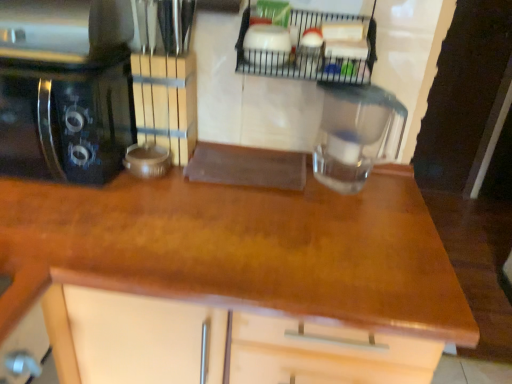
Identify the location of metallic wire rack at upper center. This screenshot has width=512, height=384. (304, 46).

The height and width of the screenshot is (384, 512). Identify the location of transparent glass jar at center. (356, 134).

What do you see at coordinates (356, 134) in the screenshot? The width and height of the screenshot is (512, 384). I see `transparent glass jar at center` at bounding box center [356, 134].

Identify the location of wooden at center. The width and height of the screenshot is (512, 384). (242, 250).

The width and height of the screenshot is (512, 384). I want to click on metallic wire rack at upper center, so click(304, 46).

Locate an element on the screen. The width and height of the screenshot is (512, 384). shelf that appears above the black glossy coffee maker at left (from a real-world perspective) is located at coordinates (304, 46).

Can you confirm if black glossy coffee maker at left is bigger than metallic wire rack at upper center?

Yes, black glossy coffee maker at left is bigger than metallic wire rack at upper center.

From a real-world perspective, is black glossy coffee maker at left positioned above or below metallic wire rack at upper center?

black glossy coffee maker at left is situated lower than metallic wire rack at upper center in the real world.

Is black glossy coffee maker at left next to metallic wire rack at upper center and touching it?

They are not placed beside each other.

How different are the orientations of metallic wire rack at upper center and black glossy coffee maker at left in degrees?

They differ by 1.03 degrees in their facing directions.

Can you confirm if metallic wire rack at upper center is thinner than black glossy coffee maker at left?

Yes.

From the image's perspective, is metallic wire rack at upper center positioned above or below black glossy coffee maker at left?

Based on their image positions, metallic wire rack at upper center is located above black glossy coffee maker at left.

Between metallic wire rack at upper center and black glossy coffee maker at left, which one appears on the left side from the viewer's perspective?

black glossy coffee maker at left.

Where is `shelf above the wooden at center (from a real-world perspective)`? shelf above the wooden at center (from a real-world perspective) is located at coordinates (304, 46).

Would you consider metallic wire rack at upper center to be distant from wooden at center?

No, there isn't a large distance between metallic wire rack at upper center and wooden at center.

Considering the positions of point (243, 15) and point (3, 265), is point (243, 15) closer or farther from the camera than point (3, 265)?

Point (243, 15).

Considering the relative positions of metallic wire rack at upper center and wooden at center in the image provided, is metallic wire rack at upper center to the left of wooden at center from the viewer's perspective?

In fact, metallic wire rack at upper center is to the right of wooden at center.

Which is closer to the camera, [340,223] or [401,139]?

Point [340,223].

Which object is further away from the camera taking this photo, wooden at center or transparent glass jar at center?

transparent glass jar at center is behind.

Which object is wider, wooden at center or transparent glass jar at center?

wooden at center.

Based on the photo, would you say wooden at center is a long distance from black glossy coffee maker at left?

That's not correct — wooden at center is a little close to black glossy coffee maker at left.

Is wooden at center in front of or behind black glossy coffee maker at left in the image?

Clearly, wooden at center is in front of black glossy coffee maker at left.

Does wooden at center have a smaller size compared to black glossy coffee maker at left?

No, wooden at center is not smaller than black glossy coffee maker at left.

Considering the positions of objects black glossy coffee maker at left and transparent glass jar at center in the image provided, who is more to the left, black glossy coffee maker at left or transparent glass jar at center?

Positioned to the left is black glossy coffee maker at left.

Is point (57, 3) closer or farther from the camera than point (370, 139)?

Point (57, 3) appears to be closer to the viewer than point (370, 139).

From a real-world perspective, between black glossy coffee maker at left and transparent glass jar at center, who is vertically lower?

black glossy coffee maker at left.

Find the location of a particular element. Image resolution: width=512 pixels, height=384 pixels. home appliance that appears in front of the transparent glass jar at center is located at coordinates (62, 105).

Is transparent glass jar at center far away from wooden at center?

Actually, transparent glass jar at center and wooden at center are a little close together.

Can you tell me how much transparent glass jar at center and wooden at center differ in facing direction?

1.19 degrees.

From a real-world perspective, relative to wooden at center, is transparent glass jar at center vertically above or below?

Clearly, from a real-world perspective, transparent glass jar at center is above wooden at center.

Based on the photo, visually, is transparent glass jar at center positioned to the left or to the right of wooden at center?

Based on their positions, transparent glass jar at center is located to the right of wooden at center.

The height and width of the screenshot is (384, 512). Identify the location of home appliance located below the metallic wire rack at upper center (from the image's perspective). (62, 105).

I want to click on home appliance beneath the metallic wire rack at upper center (from a real-world perspective), so click(x=62, y=105).

Which object lies further to the anchor point black glossy coffee maker at left, transparent glass jar at center or wooden at center?

transparent glass jar at center.

From the picture: Based on their spatial positions, is black glossy coffee maker at left or wooden at center further from transparent glass jar at center?

black glossy coffee maker at left lies further to transparent glass jar at center than the other object.

Consider the image. Considering their positions, is transparent glass jar at center positioned further to black glossy coffee maker at left than metallic wire rack at upper center?

transparent glass jar at center.

Considering their positions, is black glossy coffee maker at left positioned closer to wooden at center than transparent glass jar at center?

transparent glass jar at center.

Looking at the image, which one is located further to wooden at center, transparent glass jar at center or metallic wire rack at upper center?

metallic wire rack at upper center lies further to wooden at center than the other object.

Looking at this image, estimate the real-world distances between objects in this image. Which object is closer to metallic wire rack at upper center, wooden at center or black glossy coffee maker at left?

wooden at center lies closer to metallic wire rack at upper center than the other object.

Considering their positions, is metallic wire rack at upper center positioned closer to transparent glass jar at center than black glossy coffee maker at left?

metallic wire rack at upper center is closer to transparent glass jar at center.

Considering their positions, is wooden at center positioned closer to black glossy coffee maker at left than metallic wire rack at upper center?

wooden at center.

Identify the location of home appliance between metallic wire rack at upper center and wooden at center vertically. The image size is (512, 384). [x=62, y=105].

Where is `countertop located between black glossy coffee maker at left and transparent glass jar at center in the left-right direction`? countertop located between black glossy coffee maker at left and transparent glass jar at center in the left-right direction is located at coordinates (242, 250).

Locate an element on the screen. This screenshot has width=512, height=384. kitchen appliance between metallic wire rack at upper center and wooden at center vertically is located at coordinates (356, 134).

What are the coordinates of `shelf located between black glossy coffee maker at left and transparent glass jar at center in the left-right direction` in the screenshot? It's located at pyautogui.click(x=304, y=46).